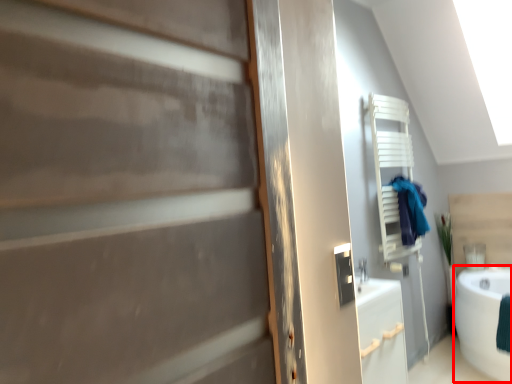
Question: From the image, what is the correct spatial relationship of bath (annotated by the red box) in relation to laundry?

Choices:
 (A) right
 (B) left

Answer: (A)